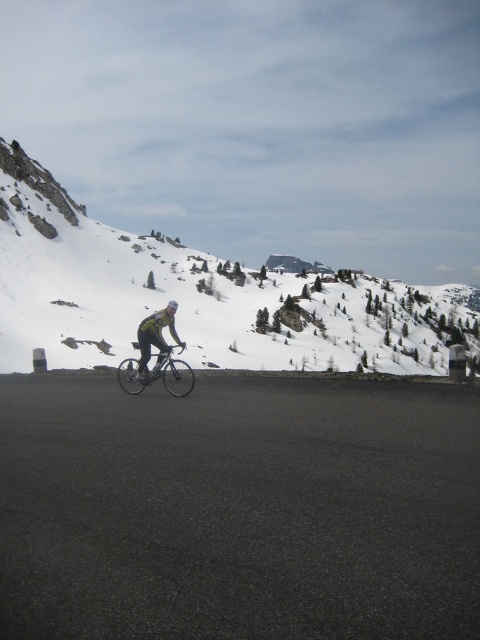
Question: Is snowy rocky mountain at upper center positioned before yellow matte helmet at center?

Choices:
 (A) no
 (B) yes

Answer: (A)

Question: Which object appears closest to the camera in this image?

Choices:
 (A) yellow-green jersey at center
 (B) shiny silver bicycle at center
 (C) snowy rocky mountain at upper center

Answer: (B)

Question: Observing the image, what is the correct spatial positioning of snowy rocky mountain at upper center in reference to yellow-green jersey at center?

Choices:
 (A) right
 (B) left

Answer: (A)

Question: Does snowy rocky mountain at upper center have a smaller size compared to yellow-green jersey at center?

Choices:
 (A) yes
 (B) no

Answer: (B)

Question: Based on their relative distances, which object is nearer to the yellow-green jersey at center?

Choices:
 (A) snowy rocky mountain at upper center
 (B) yellow matte helmet at center
 (C) shiny silver bicycle at center

Answer: (C)

Question: Which point appears closest to the camera in this image?

Choices:
 (A) (170, 304)
 (B) (168, 316)
 (C) (61, 332)

Answer: (B)